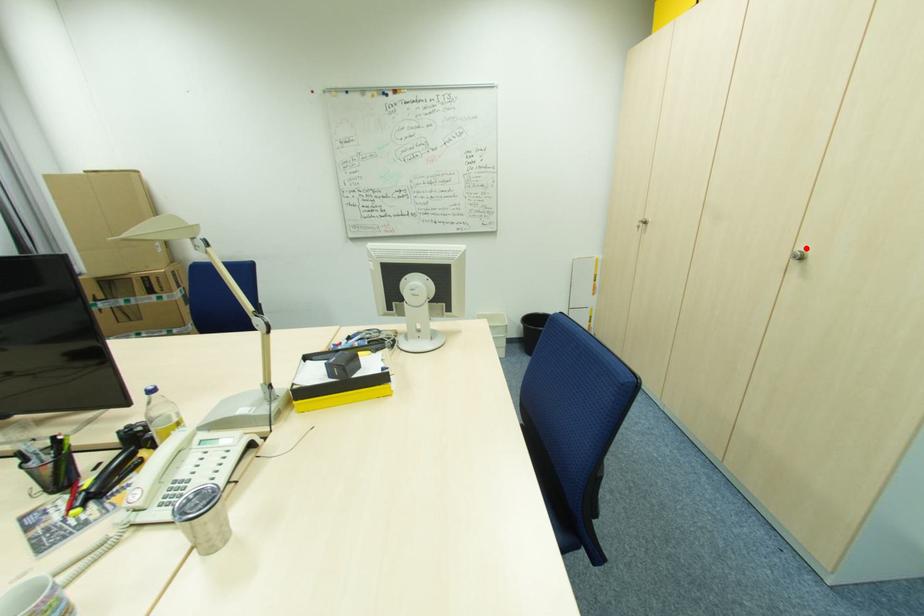
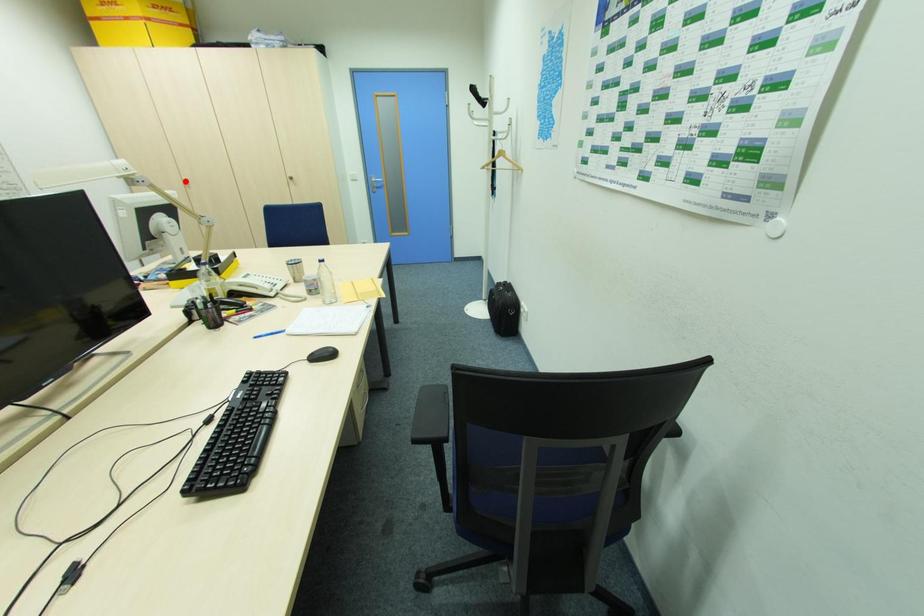
I am providing you with two images of the same scene from different viewpoints. A red point is marked on the first image and another point is marked on the second image. Does the point marked in image1 correspond to the same location as the one in image2?

No